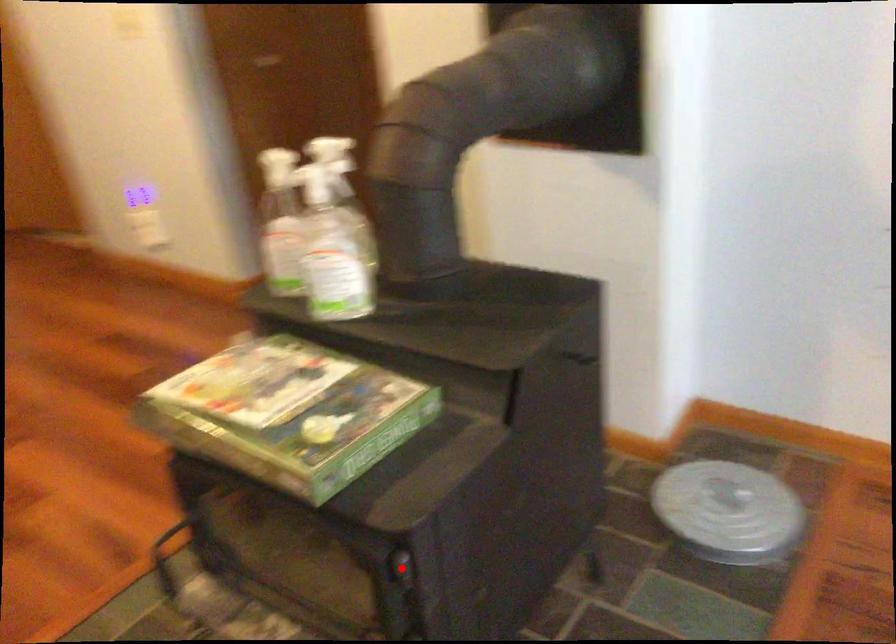
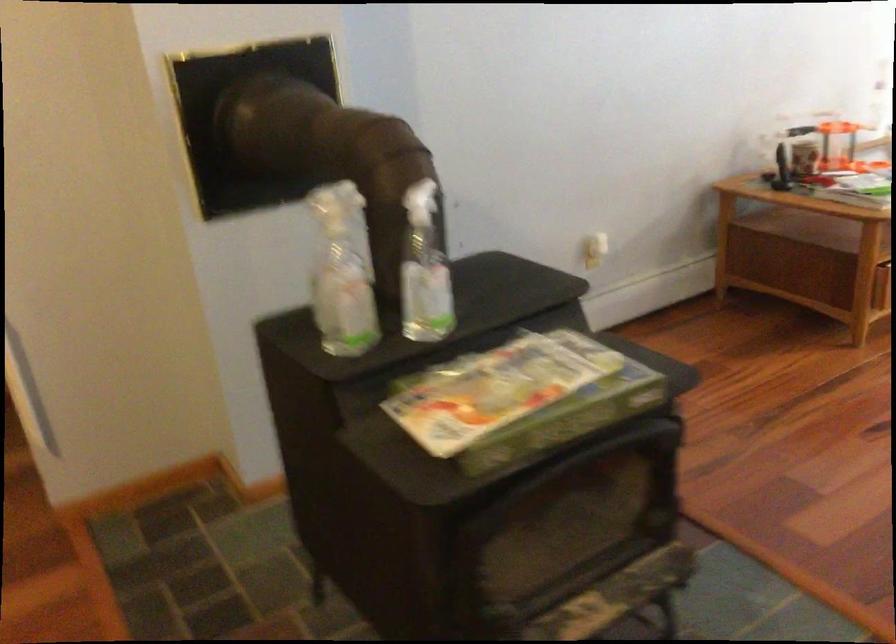
Find the pixel in the second image that matches the highlighted location in the first image.

(692, 421)